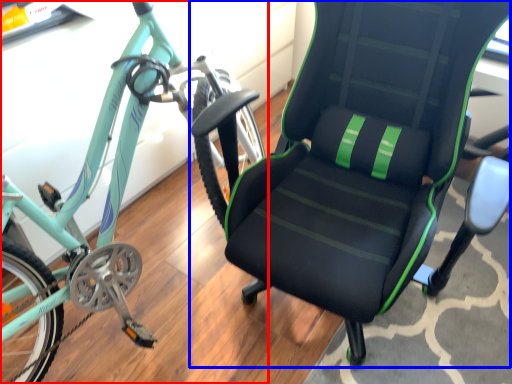
Question: Which object appears farthest to the camera in this image, bicycle (highlighted by a red box) or chair (highlighted by a blue box)?

Choices:
 (A) bicycle
 (B) chair

Answer: (B)